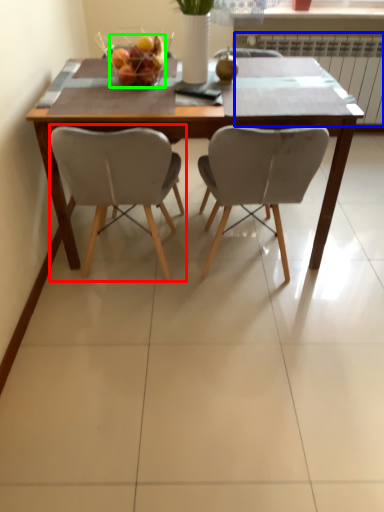
Question: Estimate the real-world distances between objects in this image. Which object is closer to chair (highlighted by a red box), radiator (highlighted by a blue box) or fruit dish (highlighted by a green box)?

Choices:
 (A) radiator
 (B) fruit dish

Answer: (B)